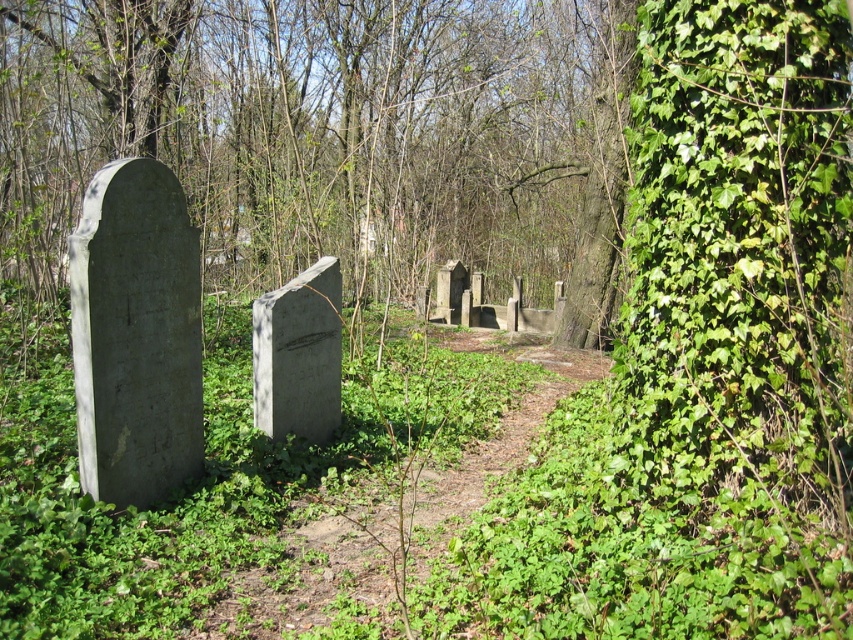
You are a gardener trying to maintain the cemetery. You need to place a 6.5 meter long fence between the green ivy at right and the gray stone gravestone at left. Will the fence be too long to fit between them?

The green ivy at right is 5.57 meters from the gray stone gravestone at left. The fence is 6.5 meters long, which is longer than the distance between them. Therefore, the fence will be too long to fit between them.

You are a visitor walking along the dirt path in the cemetery and want to place a bouquet of flowers between the two gray stone gravestones. Which direction should you walk to ensure the bouquet is placed exactly between the gray stone gravestone at left and the gray stone gravestone at center?

The gray stone gravestone at left is to the left of the gray stone gravestone at center. To place the bouquet exactly between them, you should walk towards the center of the two gravestones, positioning the bouquet midway between the gray stone gravestone at left and the gray stone gravestone at center.

You are a gardener trying to clear the cemetery path. You notice the green ivy at right and the gray stone gravestone at left. Which object would require more effort to manage due to its size?

The green ivy at right requires more effort to manage because it is larger in size than the gray stone gravestone at left.